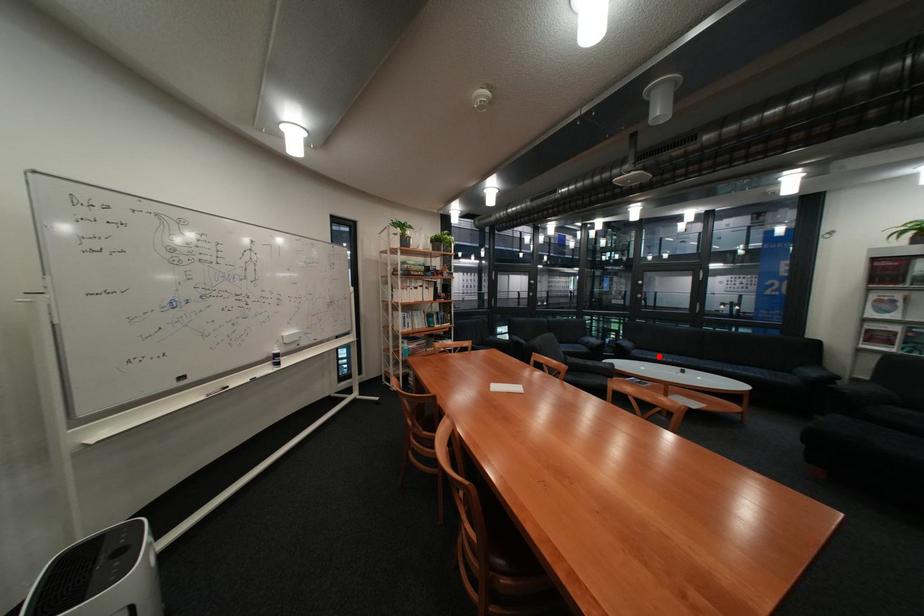
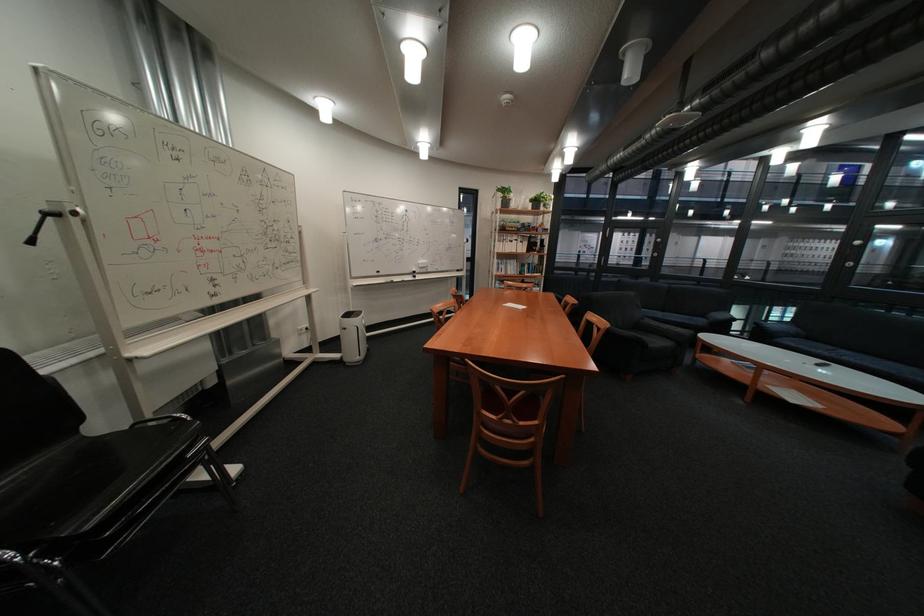
Question: I am providing you with two images of the same scene from different viewpoints. Given a red point in image1, look at the same physical point in image2. Is it:

Choices:
 (A) Closer to the viewpoint
 (B) Farther from the viewpoint

Answer: (A)